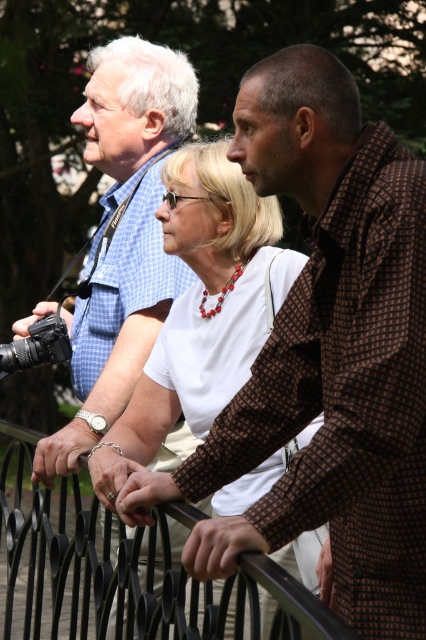
Question: Is white matte shirt at center below black wrought iron fence at center?

Choices:
 (A) yes
 (B) no

Answer: (B)

Question: Which point is closer to the camera?

Choices:
 (A) (213, 326)
 (B) (37, 333)

Answer: (A)

Question: Among these points, which one is nearest to the camera?

Choices:
 (A) (57, 316)
 (B) (103, 168)

Answer: (A)

Question: Does white matte shirt at center appear on the left side of black wrought iron fence at center?

Choices:
 (A) no
 (B) yes

Answer: (A)

Question: Is white matte shirt at center positioned before matte blue shirt at center?

Choices:
 (A) yes
 (B) no

Answer: (A)

Question: Among these points, which one is nearest to the camera?

Choices:
 (A) (74, 614)
 (B) (95, 406)

Answer: (A)